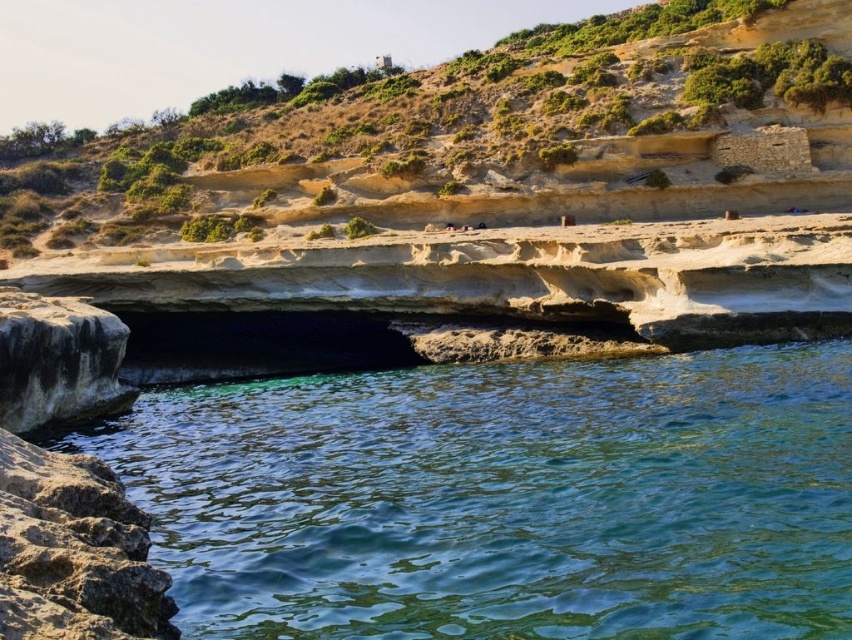
Between clear water at lower center and rough gray rock at lower left, which one appears on the right side from the viewer's perspective?

From the viewer's perspective, clear water at lower center appears more on the right side.

Does point (724, 356) come closer to viewer compared to point (12, 316)?

No, it is behind (12, 316).

Is point (758, 451) behind point (107, 332)?

No, it is not.

Locate an element on the screen. The image size is (852, 640). clear water at lower center is located at coordinates (504, 497).

At what (x,y) coordinates should I click in order to perform the action: click on rustic stone cliff at center. Please return your answer as a coordinate pair (x, y). Looking at the image, I should click on (464, 138).

Measure the distance between rustic stone cliff at center and rough textured rock at lower left.

The distance of rustic stone cliff at center from rough textured rock at lower left is 84.21 meters.

Is point (394, 116) positioned behind point (72, 516)?

Yes, it is behind point (72, 516).

At what (x,y) coordinates should I click in order to perform the action: click on rustic stone cliff at center. Please return your answer as a coordinate pair (x, y). Image resolution: width=852 pixels, height=640 pixels. Looking at the image, I should click on [464, 138].

Does rustic stone cliff at center appear under brown rough stone at upper right?

Incorrect, rustic stone cliff at center is not positioned below brown rough stone at upper right.

Does rustic stone cliff at center have a greater height compared to brown rough stone at upper right?

Yes, rustic stone cliff at center is taller than brown rough stone at upper right.

Which is in front, point (182, 188) or point (721, 134)?

Point (721, 134)

This screenshot has height=640, width=852. In order to click on rustic stone cliff at center in this screenshot , I will do `click(464, 138)`.